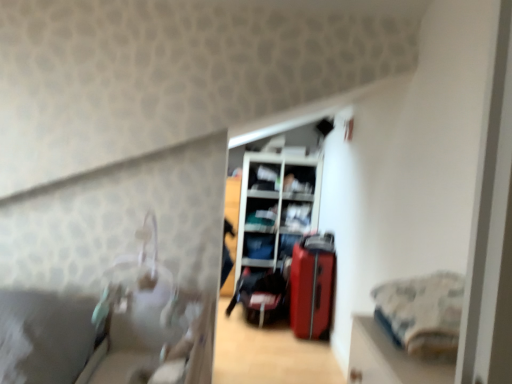
Question: Is point (287, 183) closer or farther from the camera than point (250, 218)?

Choices:
 (A) closer
 (B) farther

Answer: (B)

Question: Based on their positions, is matte white shelf at upper center, which is the 4th shelf in bottom-to-top order, located to the left or right of matte white shelf at center, marked as the 3th shelf in a top-to-bottom arrangement?

Choices:
 (A) left
 (B) right

Answer: (B)

Question: Based on their relative distances, which object is farther from the metallic silver shelf at center, which is the second shelf in bottom-to-top order?

Choices:
 (A) matte white shelf at upper center, which is the 2th shelf in top-to-bottom order
 (B) fluffy cotton blanket at right
 (C) matte black suitcase at center, the second luggage in the right-to-left sequence
 (D) metallic silver suitcase at center
 (E) matte black shelf at center, the first shelf ordered from the bottom

Answer: (B)

Question: Which is nearer to the matte black shelf at center, arranged as the fifth shelf when viewed from the top?

Choices:
 (A) metallic silver suitcase at center
 (B) matte white shelf at center, acting as the third shelf starting from the bottom
 (C) matte white shelf at upper center, which is the 4th shelf in bottom-to-top order
 (D) matte black suitcase at center, the second luggage in the right-to-left sequence
 (E) metallic silver shelf at center, which is the second shelf in bottom-to-top order

Answer: (B)